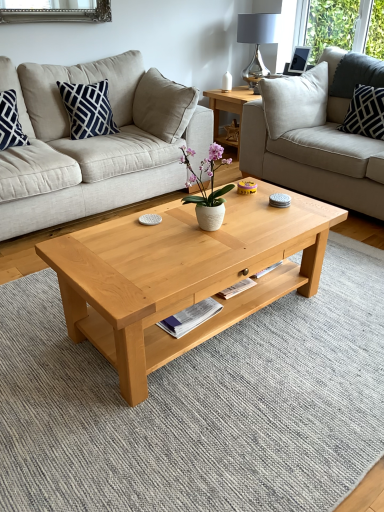
Question: Does light gray fabric couch at upper right, the 1th studio couch from the right, have a lesser width compared to metallic silver lamp at upper right?

Choices:
 (A) yes
 (B) no

Answer: (B)

Question: Does light gray fabric couch at upper right, the 1th studio couch from the right, have a larger size compared to metallic silver lamp at upper right?

Choices:
 (A) no
 (B) yes

Answer: (B)

Question: From the image's perspective, is light gray fabric couch at upper right, the 1th studio couch from the right, under metallic silver lamp at upper right?

Choices:
 (A) yes
 (B) no

Answer: (A)

Question: Is light gray fabric couch at upper right, the 1th studio couch from the right, with metallic silver lamp at upper right?

Choices:
 (A) yes
 (B) no

Answer: (B)

Question: From a real-world perspective, does light gray fabric couch at upper right, marked as the second studio couch in a left-to-right arrangement, sit lower than metallic silver lamp at upper right?

Choices:
 (A) no
 (B) yes

Answer: (B)

Question: Is light gray fabric couch at upper right, marked as the second studio couch in a left-to-right arrangement, located outside metallic silver lamp at upper right?

Choices:
 (A) no
 (B) yes

Answer: (B)

Question: Is white cotton pillow at upper right, the 2th pillow when ordered from left to right, smaller than natural wood coffee table at center?

Choices:
 (A) yes
 (B) no

Answer: (A)

Question: Is white cotton pillow at upper right, the 2th pillow when ordered from left to right, at the right side of natural wood coffee table at center?

Choices:
 (A) yes
 (B) no

Answer: (A)

Question: Is white cotton pillow at upper right, the 1th pillow when ordered from right to left, bigger than natural wood coffee table at center?

Choices:
 (A) no
 (B) yes

Answer: (A)

Question: Is white cotton pillow at upper right, the 2th pillow when ordered from left to right, at the left side of natural wood coffee table at center?

Choices:
 (A) no
 (B) yes

Answer: (A)

Question: Does white cotton pillow at upper right, the 1th pillow when ordered from right to left, have a greater height compared to natural wood coffee table at center?

Choices:
 (A) yes
 (B) no

Answer: (B)

Question: Is white cotton pillow at upper right, the 1th pillow when ordered from right to left, oriented towards natural wood coffee table at center?

Choices:
 (A) yes
 (B) no

Answer: (A)

Question: From the image's perspective, is metallic silver lamp at upper right over white cotton pillow at upper right, the 2th pillow when ordered from left to right?

Choices:
 (A) no
 (B) yes

Answer: (B)